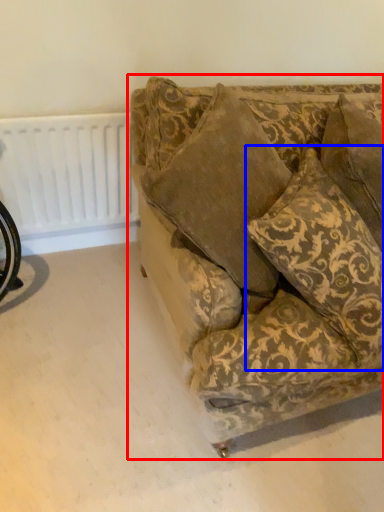
Question: Which object is further to the camera taking this photo, studio couch (highlighted by a red box) or throw pillow (highlighted by a blue box)?

Choices:
 (A) studio couch
 (B) throw pillow

Answer: (B)